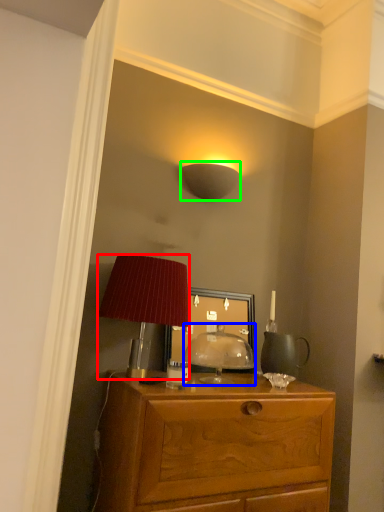
Question: Which object is positioned farthest from lamp (highlighted by a red box)? Select from table lamp (highlighted by a blue box) and lamp (highlighted by a green box).

Choices:
 (A) table lamp
 (B) lamp

Answer: (B)